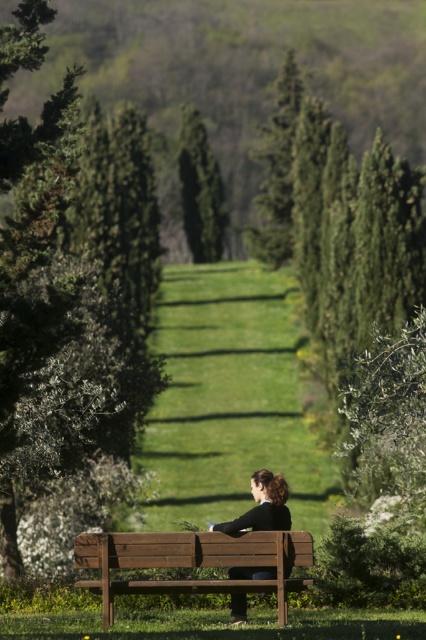
Question: Among these objects, which one is farthest from the camera?

Choices:
 (A) black leather jacket at center
 (B) green leafy tree at left

Answer: (A)

Question: Does green leafy tree at left have a lesser width compared to black leather jacket at center?

Choices:
 (A) no
 (B) yes

Answer: (A)

Question: Considering the real-world distances, which object is farthest from the black leather jacket at center?

Choices:
 (A) wooden bench at center
 (B) green leafy tree at left
 (C) green textured tree at center

Answer: (C)

Question: Which point is farther to the camera?

Choices:
 (A) pyautogui.click(x=183, y=147)
 (B) pyautogui.click(x=26, y=344)

Answer: (A)

Question: Does green leafy tree at left appear on the left side of green textured tree at center?

Choices:
 (A) no
 (B) yes

Answer: (B)

Question: Considering the relative positions of green leafy tree at left and wooden bench at center in the image provided, where is green leafy tree at left located with respect to wooden bench at center?

Choices:
 (A) right
 (B) left

Answer: (B)